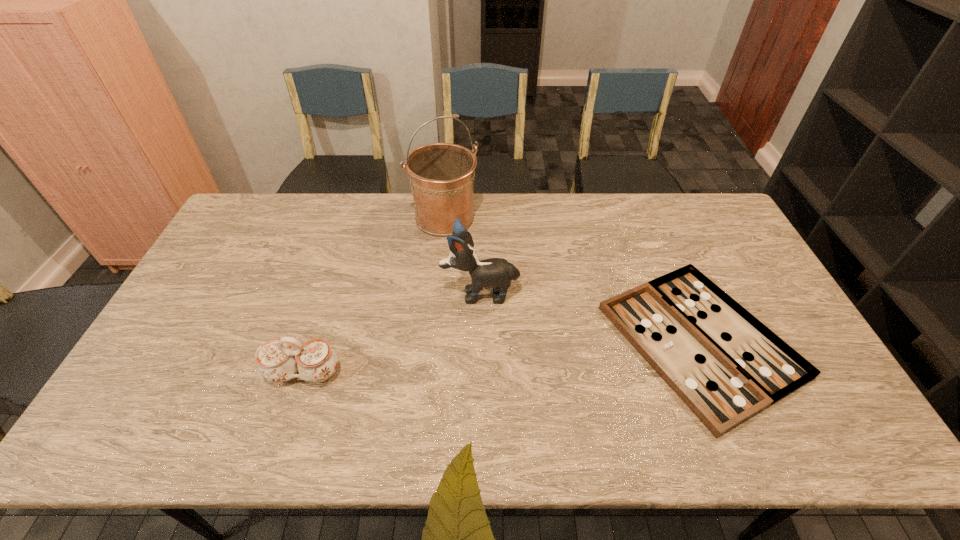
Find the location of a particular element. The image size is (960, 540). vacant region at the right edge of the desktop is located at coordinates (719, 262).

Locate an element on the screen. vacant region at the far right corner of the desktop is located at coordinates (678, 211).

Locate an element on the screen. Image resolution: width=960 pixels, height=540 pixels. vacant space that's between the farthest object and the shortest object is located at coordinates (572, 280).

Where is `vacant point located between the shortest object and the second tallest object`? The image size is (960, 540). vacant point located between the shortest object and the second tallest object is located at coordinates (590, 317).

Locate an element on the screen. vacant area that lies between the third tallest object and the gameboard is located at coordinates (502, 357).

Locate an element on the screen. unoccupied position between the shortest object and the third shortest object is located at coordinates (590, 317).

What are the coordinates of `vacant space that's between the rightmost object and the chinaware` in the screenshot? It's located at (502, 357).

Find the location of a particular element. The image size is (960, 540). unoccupied area between the second shortest object and the gameboard is located at coordinates (502, 357).

The image size is (960, 540). Find the location of `vacant space that's between the farthest object and the shortest object`. vacant space that's between the farthest object and the shortest object is located at coordinates tap(572, 280).

This screenshot has height=540, width=960. In order to click on vacant space that's between the rightmost object and the puppy in this screenshot , I will do `click(590, 317)`.